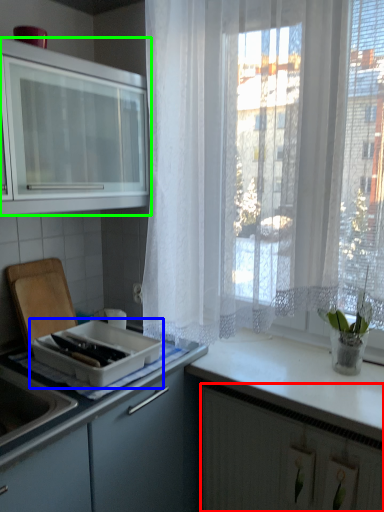
Question: Estimate the real-world distances between objects in this image. Which object is farther from cabinetry (highlighted by a red box), kitchen appliance (highlighted by a blue box) or cabinetry (highlighted by a green box)?

Choices:
 (A) kitchen appliance
 (B) cabinetry

Answer: (B)